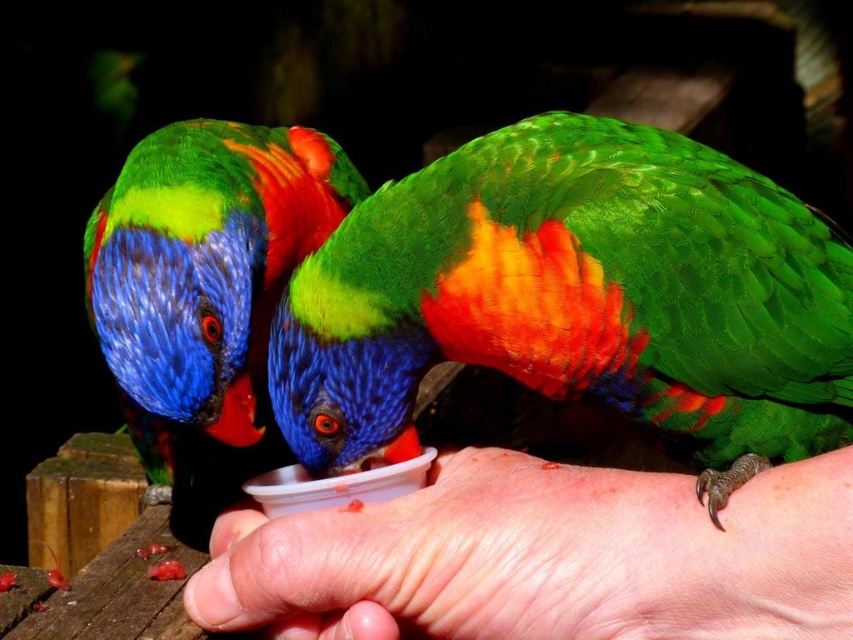
You are a photographer trying to capture a closeup shot of the shiny multicolored parrot at center. The smooth skin hand at lower center is currently blocking part of the parrot. Can you adjust your position to avoid the hand without moving the hand itself?

The smooth skin hand at lower center is positioned under the shiny multicolored parrot at center. To avoid the hand, you can move your camera slightly upward to capture the parrot while keeping the hand out of frame.

You are a photographer aiming to capture the shiny multicolored parrot at center and the smooth skin hand at lower center in a portrait. Which subject should you focus on if you want the one closer to the camera?

The smooth skin hand at lower center is closer to the camera than the shiny multicolored parrot at center because it is shorter.

In the scene shown: You are a bird trainer who needs to place both the green glossy parrot at center and the shiny multicolored parrot at center into a cage that can only accommodate a bird with a width of 30 cm. Based on their widths, can both birds fit into the cage simultaneously?

The green glossy parrot at center might be wider than the shiny multicolored parrot at center. Since the cage can only hold a bird up to 30 cm wide, if the green glossy parrot at center exceeds this width, both cannot fit together. However, if it is within 30 cm, then both could potentially fit. The exact answer depends on the actual width of the green glossy parrot at center.